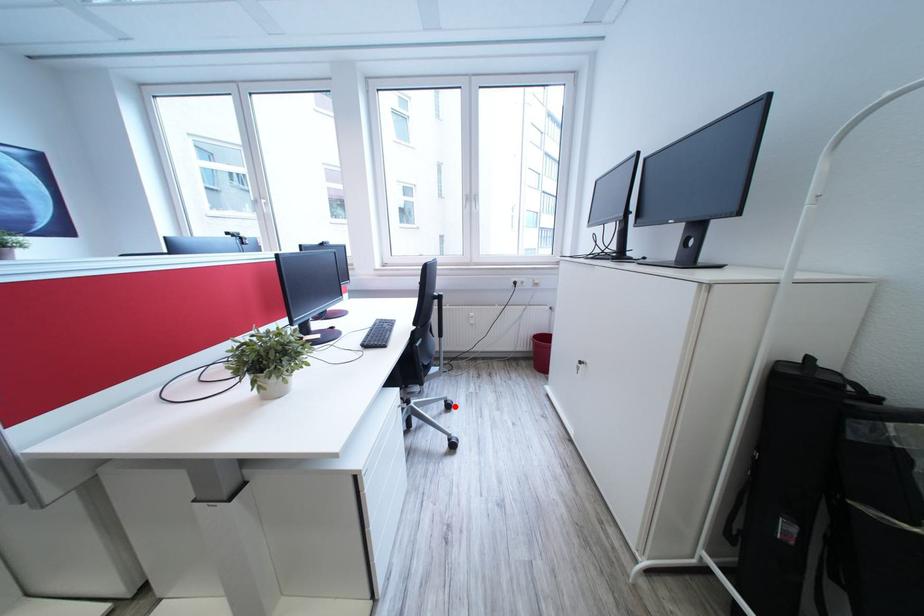
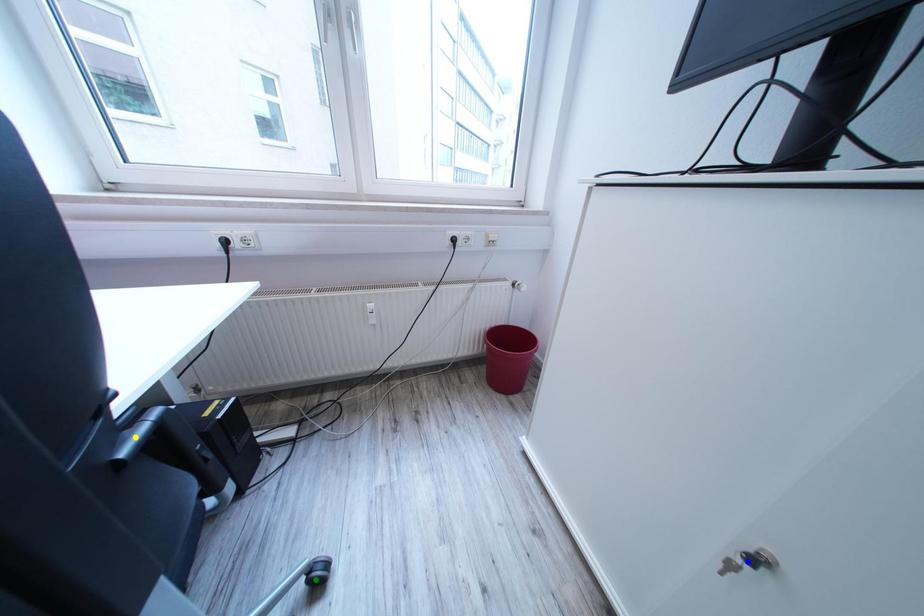
Question: I am providing you with two images of the same scene from different viewpoints. A red point is marked on the first image. You are given multiple points on the second image. Which mark in image 2 goes with the point in image 1?

Choices:
 (A) yellow point
 (B) green point
 (C) blue point

Answer: (B)